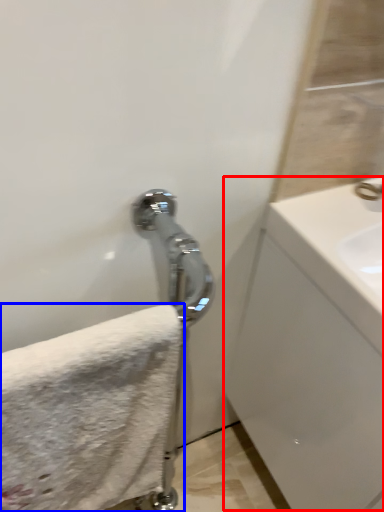
Question: Which point is further to the camera, counter top (highlighted by a red box) or towel (highlighted by a blue box)?

Choices:
 (A) counter top
 (B) towel

Answer: (A)